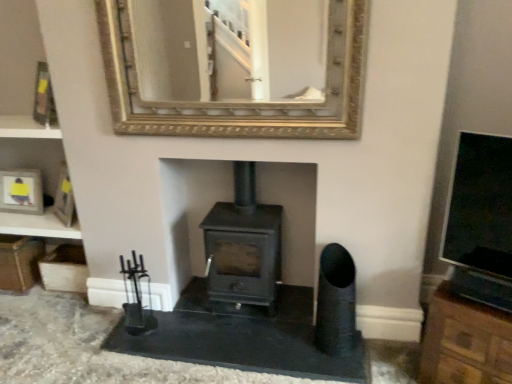
Locate an element on the screen. vacant area situated below gold-framed mirror at upper center (from a real-world perspective) is located at coordinates (239, 321).